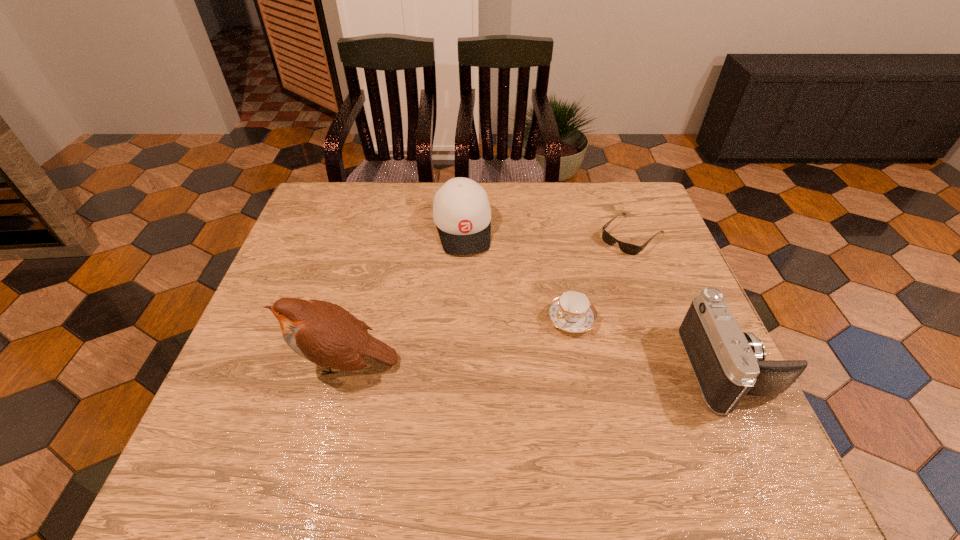
Locate an element on the screen. free point at the near edge is located at coordinates tap(384, 392).

I want to click on free space at the left edge, so click(x=272, y=315).

Locate an element on the screen. Image resolution: width=960 pixels, height=540 pixels. vacant space at the right edge is located at coordinates (630, 239).

Find the location of a particular element. The width and height of the screenshot is (960, 540). blank area at the far left corner is located at coordinates click(337, 197).

You are a GUI agent. You are given a task and a screenshot of the screen. Output one action in this format:
    pyautogui.click(x=<x>, y=<y>)
    Task: Click on the vacant space at the near left corner
    The height and width of the screenshot is (540, 960).
    Given the screenshot: What is the action you would take?
    pyautogui.click(x=220, y=416)

At what (x,y) coordinates should I click in order to perform the action: click on free region at the far right corner of the desktop. Please return your answer as a coordinate pair (x, y). Image resolution: width=960 pixels, height=540 pixels. Looking at the image, I should click on (608, 219).

At what (x,y) coordinates should I click in order to perform the action: click on free spot between the sunglasses and the bird. Please return your answer as a coordinate pair (x, y). This screenshot has width=960, height=540. Looking at the image, I should click on (489, 299).

You are a GUI agent. You are given a task and a screenshot of the screen. Output one action in this format:
    pyautogui.click(x=<x>, y=<y>)
    Task: Click on the free area in between the shortest object and the camera
    
    Given the screenshot: What is the action you would take?
    pyautogui.click(x=681, y=301)

Image resolution: width=960 pixels, height=540 pixels. Identify the location of vacant area between the sunglasses and the second object from left to right. (547, 231).

Where is `free space between the second object from left to right and the bird`? This screenshot has height=540, width=960. free space between the second object from left to right and the bird is located at coordinates (403, 295).